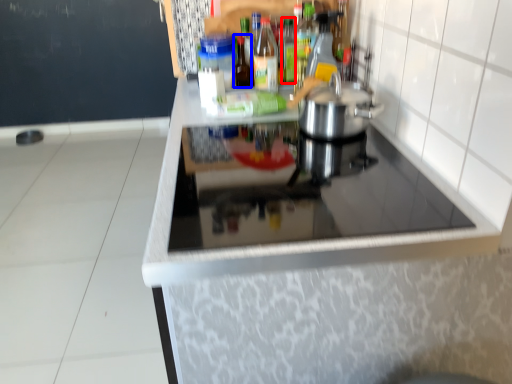
Question: Which object appears closest to the camera in this image, bottle (highlighted by a red box) or bottle (highlighted by a blue box)?

Choices:
 (A) bottle
 (B) bottle

Answer: (B)